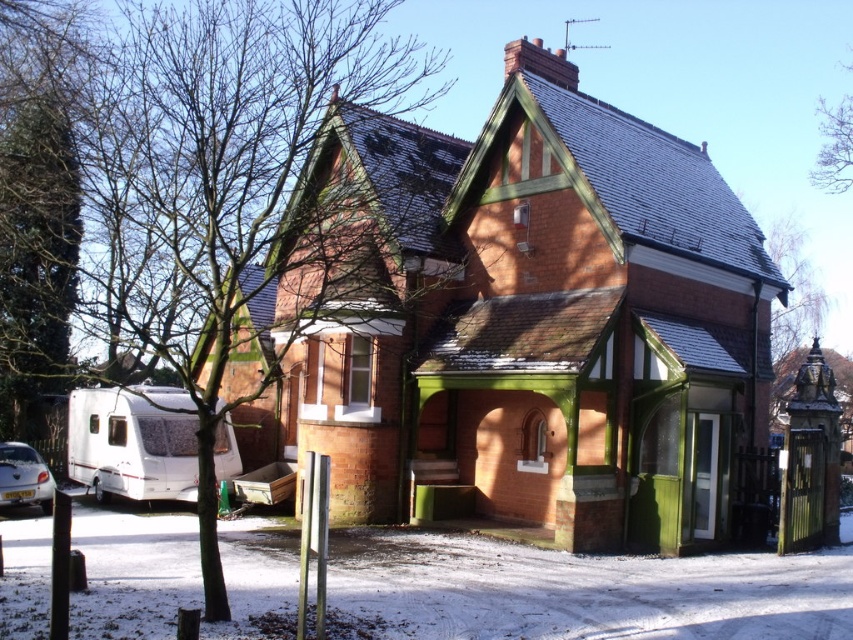
Question: Is white textured van at lower left further to camera compared to metallic silver car at lower left?

Choices:
 (A) no
 (B) yes

Answer: (B)

Question: Can you confirm if white textured van at lower left is positioned to the left of metallic silver car at lower left?

Choices:
 (A) yes
 (B) no

Answer: (B)

Question: Which of the following is the farthest from the observer?

Choices:
 (A) (131, 388)
 (B) (33, 451)

Answer: (B)

Question: Observing the image, what is the correct spatial positioning of white textured van at lower left in reference to metallic silver car at lower left?

Choices:
 (A) right
 (B) left

Answer: (A)

Question: Which point is closer to the camera?

Choices:
 (A) (112, 444)
 (B) (45, 502)

Answer: (B)

Question: Which point is closer to the camera?

Choices:
 (A) white textured van at lower left
 (B) metallic silver car at lower left

Answer: (B)